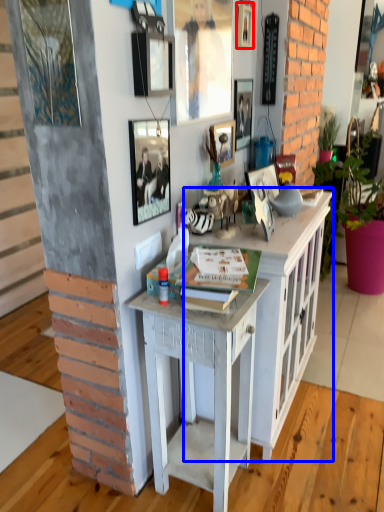
Question: Which point is closer to the camera, picture frame (highlighted by a red box) or cabinetry (highlighted by a blue box)?

Choices:
 (A) picture frame
 (B) cabinetry

Answer: (B)